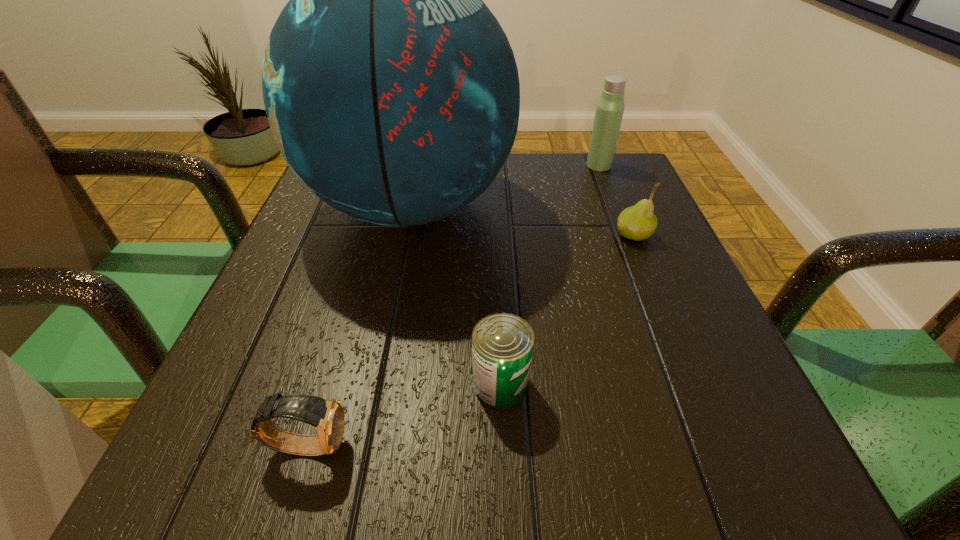
Where is `vacant area that lies between the watch and the tallest object`? This screenshot has width=960, height=540. vacant area that lies between the watch and the tallest object is located at coordinates (359, 326).

I want to click on vacant area that lies between the pear and the watch, so click(x=470, y=340).

The width and height of the screenshot is (960, 540). I want to click on empty location between the thermos bottle and the nearest object, so click(453, 305).

This screenshot has width=960, height=540. Find the location of `empty space that is in between the nearest object and the tallest object`. empty space that is in between the nearest object and the tallest object is located at coordinates (359, 326).

At what (x,y) coordinates should I click in order to perform the action: click on vacant area between the globe and the second nearest object. Please return your answer as a coordinate pair (x, y). The height and width of the screenshot is (540, 960). Looking at the image, I should click on 455,295.

Where is `object that stands as the third closest to the globe`? object that stands as the third closest to the globe is located at coordinates (638, 222).

Identify which object is located as the second nearest to the thermos bottle. Please provide its 2D coordinates. Your answer should be formatted as a tuple, i.e. [(x, y)], where the tuple contains the x and y coordinates of a point satisfying the conditions above.

[(638, 222)]

Find the location of a particular element. This screenshot has width=960, height=540. vacant space that satisfies the following two spatial constraints: 1. on the front side of the pear; 2. on the left side of the tallest object is located at coordinates (404, 235).